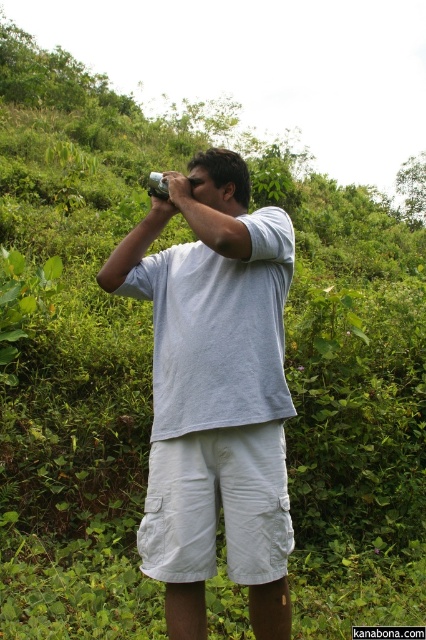
Is white cotton shirt at center thinner than white cotton shorts at center?

In fact, white cotton shirt at center might be wider than white cotton shorts at center.

Does point (187, 221) come closer to viewer compared to point (173, 580)?

No, it is not.

What are the coordinates of `white cotton shirt at center` in the screenshot? It's located at (215, 392).

The width and height of the screenshot is (426, 640). Find the location of `white cotton shirt at center`. white cotton shirt at center is located at coordinates (215, 392).